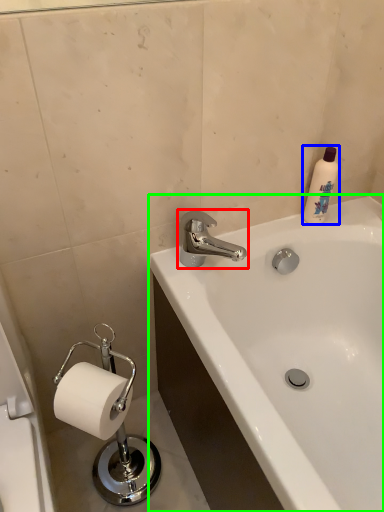
Question: Which object is the closest to the tap (highlighted by a red box)? Choose among these: cleaning product (highlighted by a blue box) or bathtub (highlighted by a green box).

Choices:
 (A) cleaning product
 (B) bathtub

Answer: (A)